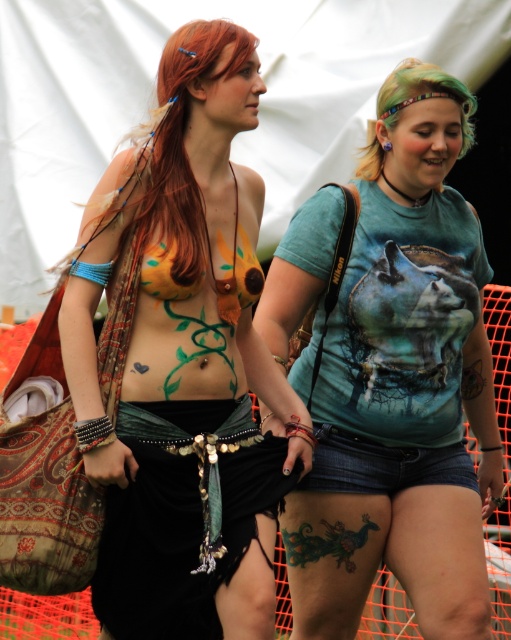
You are standing at the position of point (224, 332) and want to walk towards point (485, 513). Is the path clear? Please explain your reasoning based on their positions.

Point (485, 513) is behind point (224, 332), so the path might be blocked by the person or object at point (224, 332). Therefore, the path is not clear.